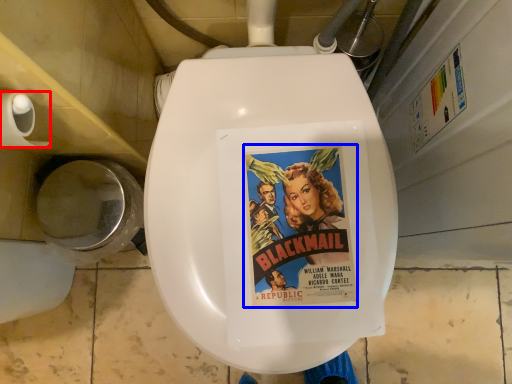
Question: Which point is closer to the camera, toilet paper (highlighted by a red box) or movie poster (highlighted by a blue box)?

Choices:
 (A) toilet paper
 (B) movie poster

Answer: (A)